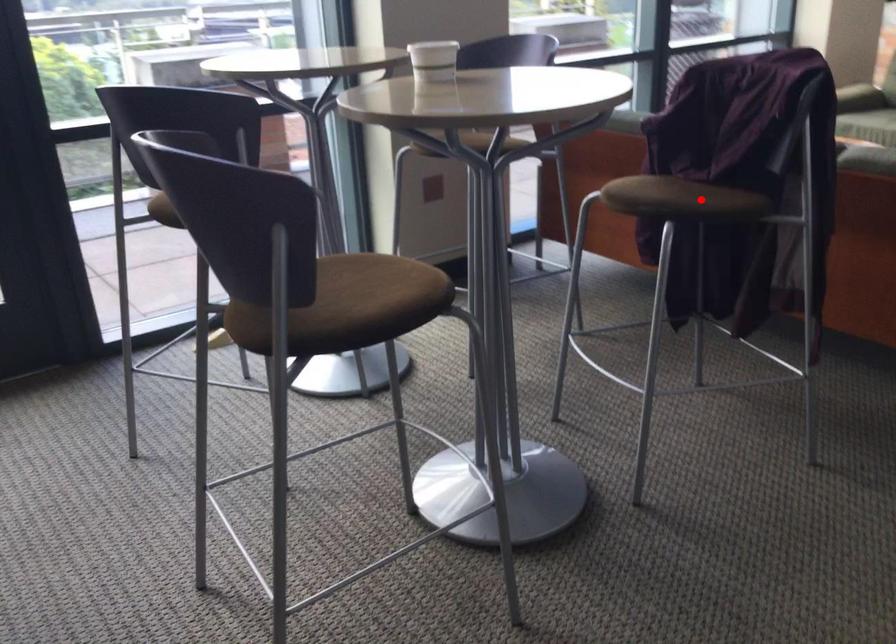
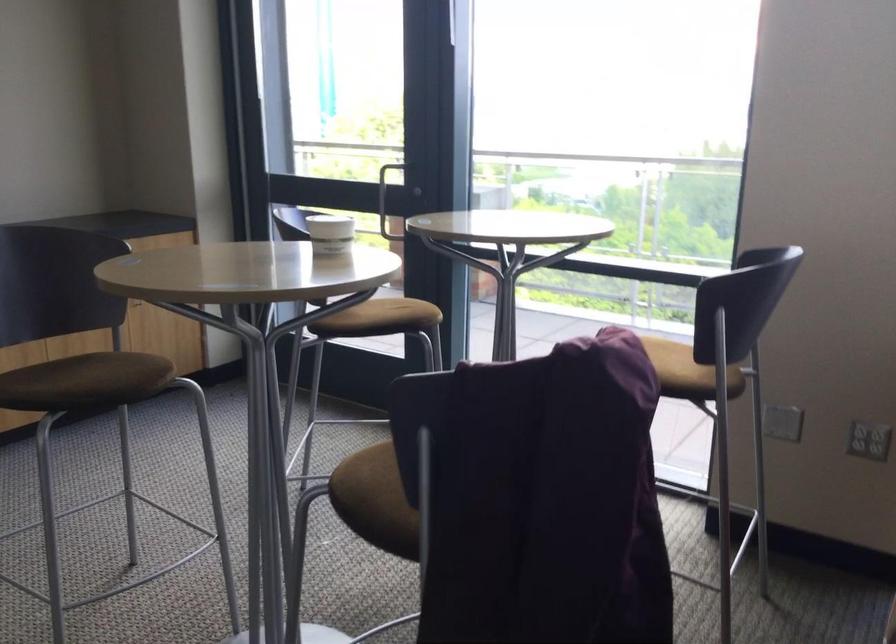
Find the pixel in the second image that matches the highlighted location in the first image.

(369, 500)